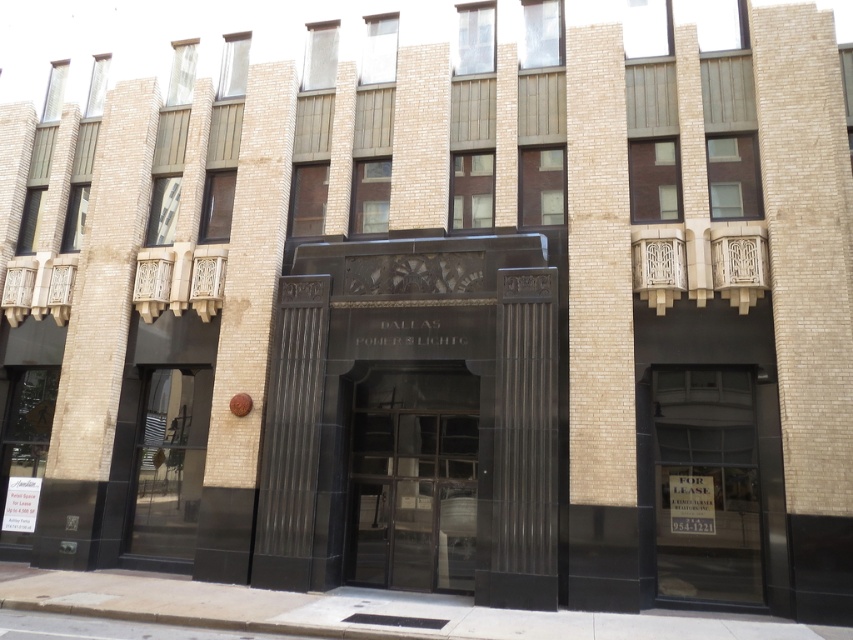
Question: Is black polished stone entrance at center to the right of clear glass door at center from the viewer's perspective?

Choices:
 (A) yes
 (B) no

Answer: (B)

Question: Can you confirm if black polished stone entrance at center is thinner than transparent glass door at lower left?

Choices:
 (A) yes
 (B) no

Answer: (A)

Question: Estimate the real-world distances between objects in this image. Which object is closer to the black polished stone entrance at center?

Choices:
 (A) transparent glass door at lower left
 (B) transparent glass door at center
 (C) clear glass door at center

Answer: (C)

Question: Is clear glass door at center to the right of transparent glass door at lower left from the viewer's perspective?

Choices:
 (A) yes
 (B) no

Answer: (A)

Question: Based on their relative distances, which object is nearer to the transparent glass door at center?

Choices:
 (A) transparent glass door at lower left
 (B) black polished stone entrance at center

Answer: (B)

Question: Among these points, which one is nearest to the camera?

Choices:
 (A) (666, 595)
 (B) (384, 573)
 (C) (537, 524)
 (D) (173, 451)

Answer: (C)